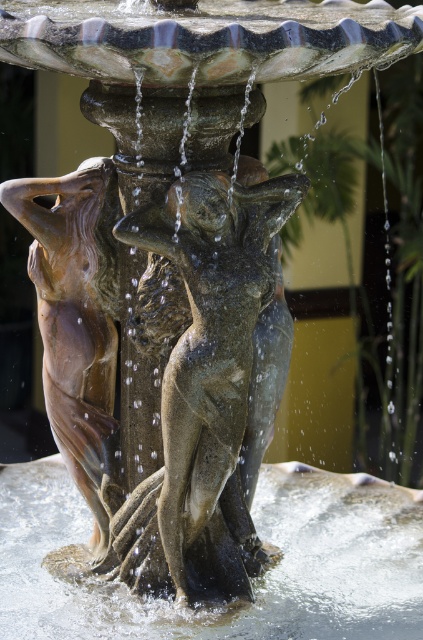
Can you confirm if bronze statue at center is positioned to the left of clear water at base center?

Yes, bronze statue at center is to the left of clear water at base center.

Does bronze statue at center appear over clear water at base center?

Indeed, bronze statue at center is positioned over clear water at base center.

At what (x,y) coordinates should I click in order to perform the action: click on bronze statue at center. Please return your answer as a coordinate pair (x, y). This screenshot has height=640, width=423. Looking at the image, I should click on (206, 387).